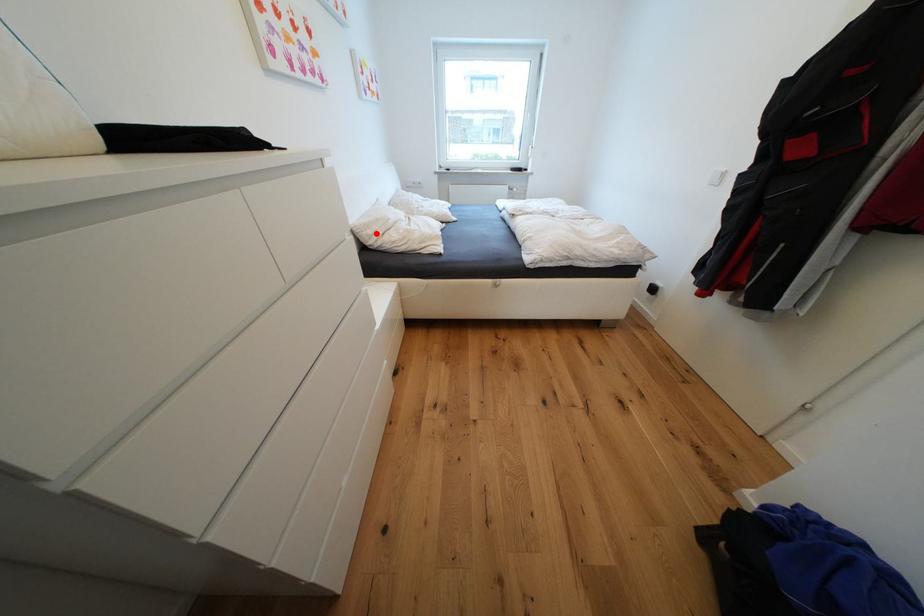
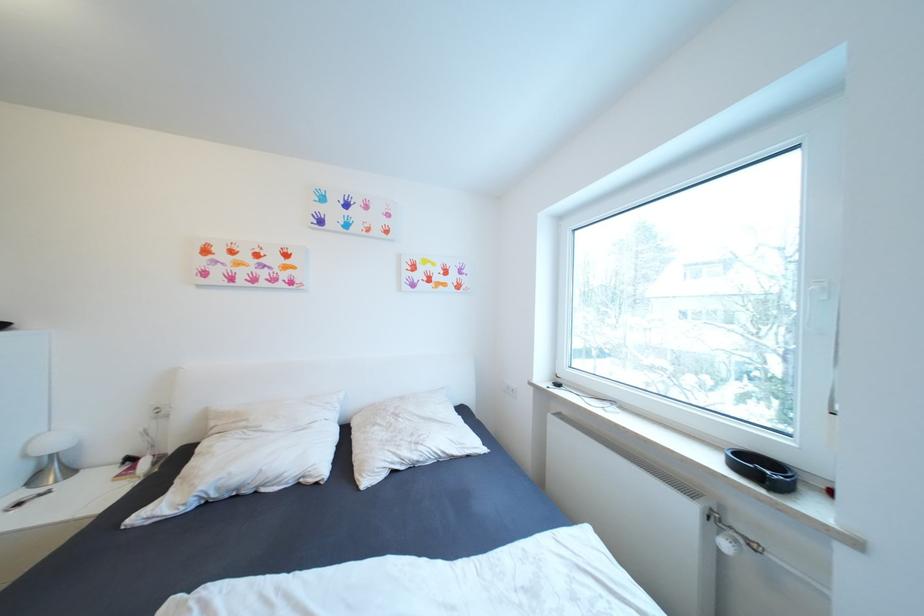
Question: A red point is marked in image1. In image2, is the corresponding 3D point closer to the camera or farther? Reply with the corresponding letter.

Choices:
 (A) The corresponding 3D point is closer.
 (B) The corresponding 3D point is farther.

Answer: (B)